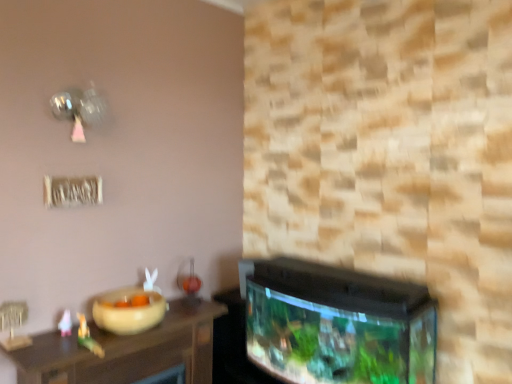
Question: Do you think matte green toy at left, which is the 2th toy from left to right, is within beige matte bowl at lower left, or outside of it?

Choices:
 (A) outside
 (B) inside

Answer: (A)

Question: Is matte green toy at left, the 2th toy from the back, to the left or to the right of beige matte bowl at lower left in the image?

Choices:
 (A) right
 (B) left

Answer: (B)

Question: Estimate the real-world distances between objects in this image. Which object is farther from the pink paper airplane at lower left, marked as the second toy in a front-to-back arrangement?

Choices:
 (A) beige matte bowl at lower left
 (B) matte green toy at left, which appears as the first toy when viewed from the front
 (C) wooden table at lower left

Answer: (C)

Question: Considering the real-world distances, which object is closest to the matte green toy at left, which appears as the first toy when viewed from the front?

Choices:
 (A) wooden table at lower left
 (B) pink paper airplane at lower left, placed as the first toy when sorted from left to right
 (C) beige matte bowl at lower left

Answer: (B)